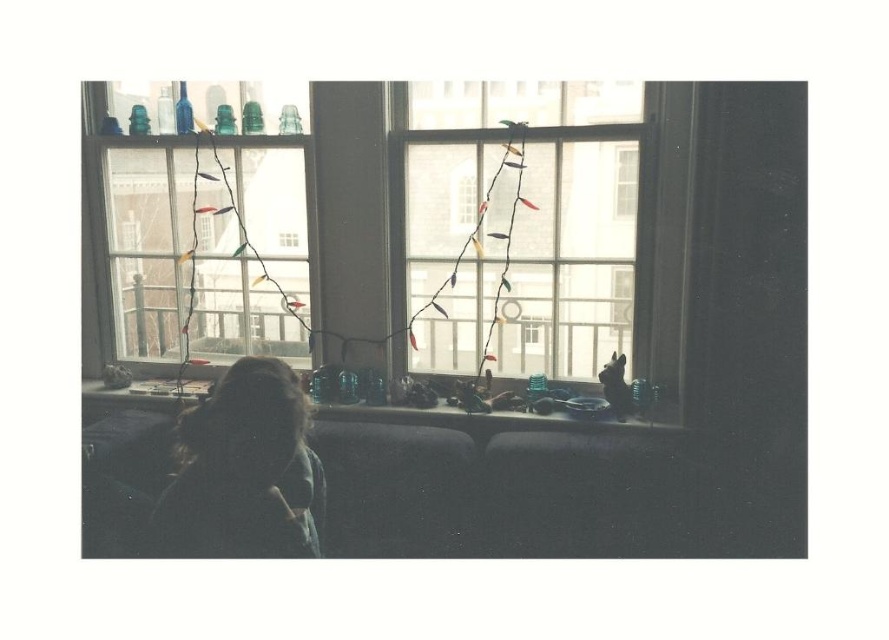
Does transparent glass window at center have a larger size compared to clear glass window at upper center?

Yes.

Can you confirm if transparent glass window at center is taller than clear glass window at upper center?

Yes, transparent glass window at center is taller than clear glass window at upper center.

What do you see at coordinates (519, 225) in the screenshot? I see `transparent glass window at center` at bounding box center [519, 225].

Locate an element on the screen. transparent glass window at center is located at coordinates (519, 225).

Is translucent glass window at center positioned in front of translucent glass objects at lower center?

That is False.

The width and height of the screenshot is (889, 640). I want to click on translucent glass window at center, so click(x=207, y=252).

Can you confirm if clear glass window at center is taller than translucent glass objects at lower center?

Indeed, clear glass window at center has a greater height compared to translucent glass objects at lower center.

You are a GUI agent. You are given a task and a screenshot of the screen. Output one action in this format:
    pyautogui.click(x=<x>, y=<y>)
    Task: Click on the clear glass window at center
    This screenshot has height=640, width=889.
    Given the screenshot: What is the action you would take?
    pyautogui.click(x=402, y=236)

The height and width of the screenshot is (640, 889). In order to click on clear glass window at center in this screenshot , I will do `click(402, 236)`.